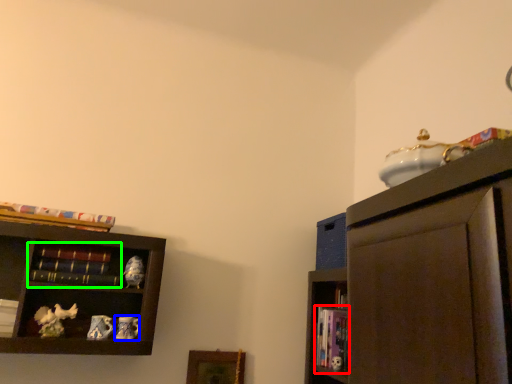
Question: Which is nearer to the book (highlighted by a red box)? toy (highlighted by a blue box) or book (highlighted by a green box).

Choices:
 (A) toy
 (B) book

Answer: (A)